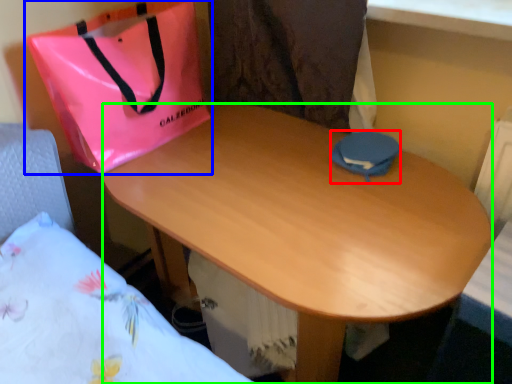
Question: Based on their relative distances, which object is nearer to pouch (highlighted by a red box)? Choose from handbag (highlighted by a blue box) and desk (highlighted by a green box).

Choices:
 (A) handbag
 (B) desk

Answer: (B)